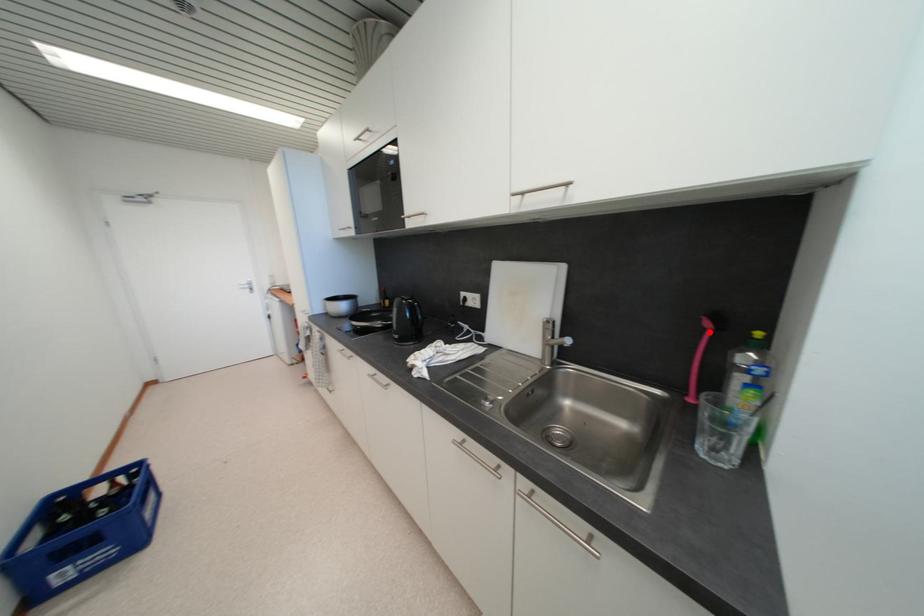
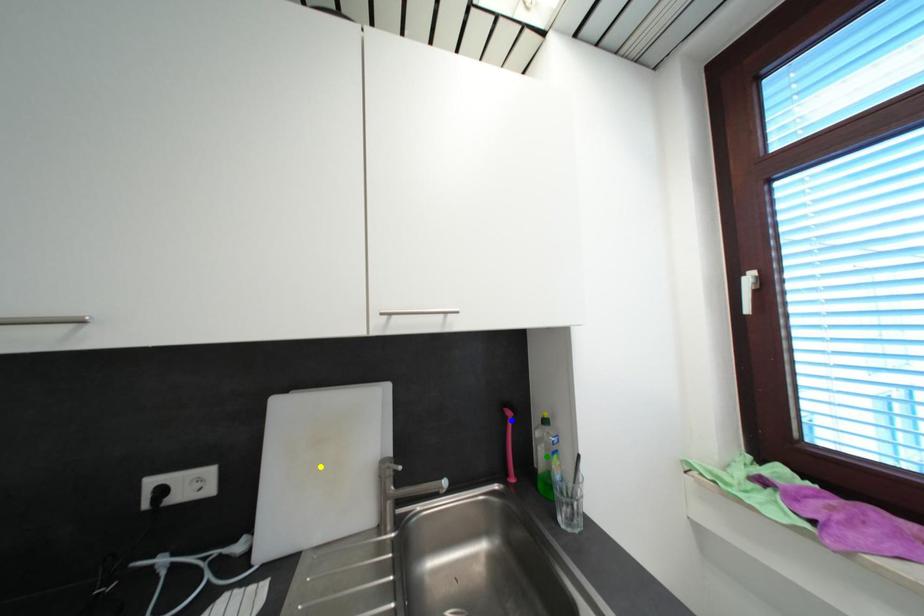
Question: I am providing you with two images of the same scene from different viewpoints. A red point is marked on the first image. You are given multiple points on the second image. Which spot in image 2 lines up with the point in image 1?

Choices:
 (A) blue point
 (B) green point
 (C) yellow point

Answer: (A)